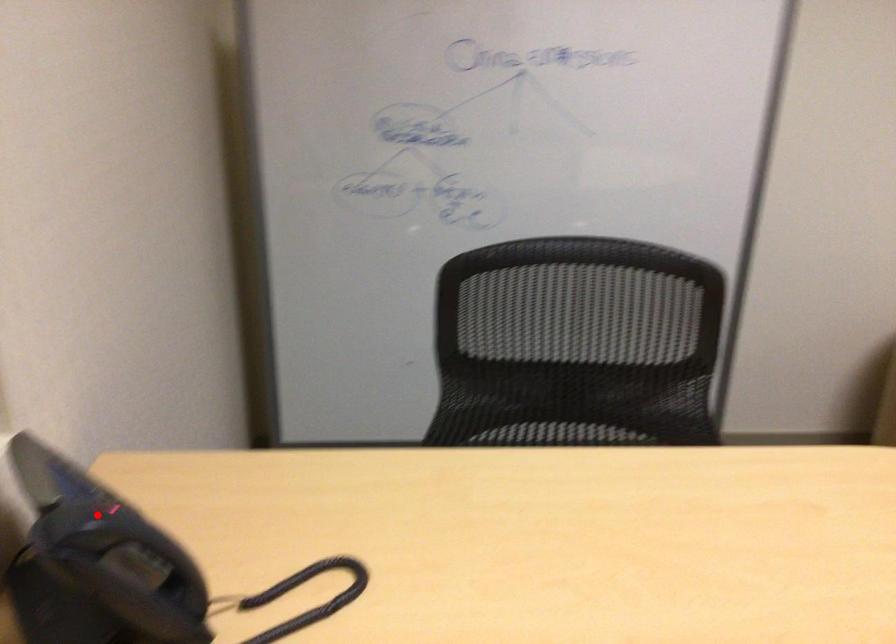
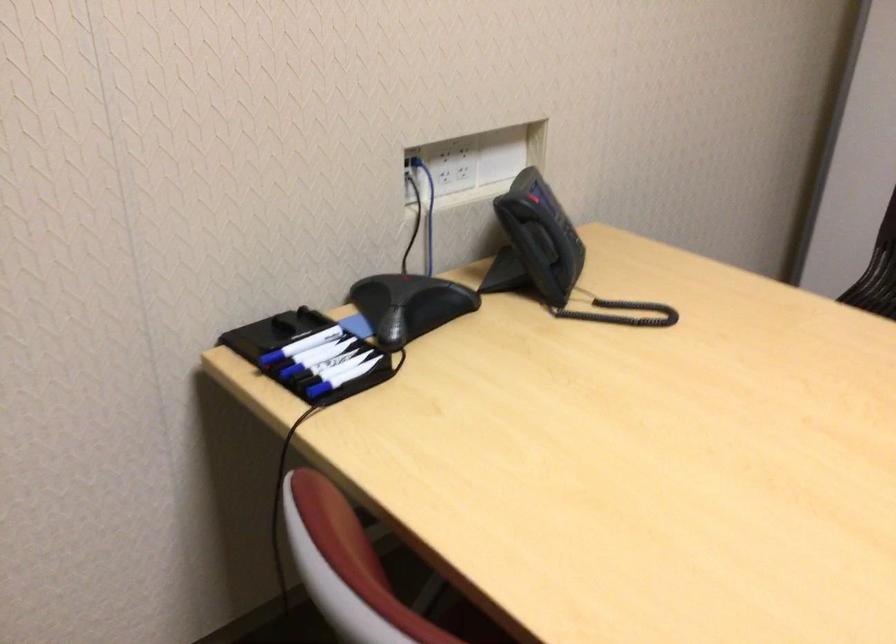
Find the pixel in the second image that matches the highlighted location in the first image.

(530, 202)